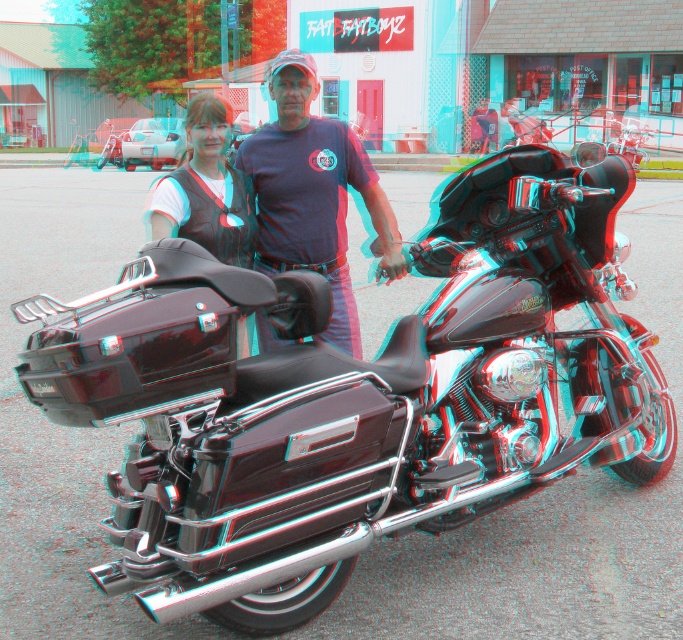
Is matte blue shirt at center in front of matte black vest at center?

No, matte blue shirt at center is further to the viewer.

Which is behind, point (326, 176) or point (197, 205)?

Positioned behind is point (326, 176).

You are a GUI agent. You are given a task and a screenshot of the screen. Output one action in this format:
    pyautogui.click(x=<x>, y=<y>)
    Task: Click on the matte blue shirt at center
    The image size is (683, 640).
    Given the screenshot: What is the action you would take?
    pyautogui.click(x=313, y=195)